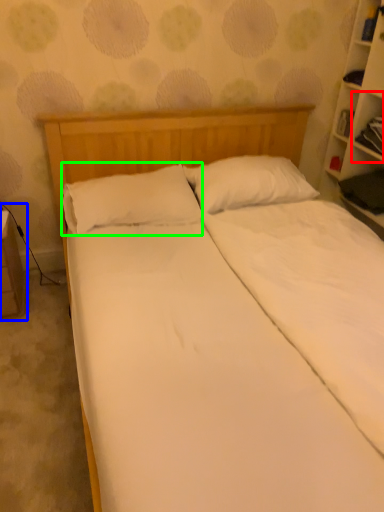
Question: Based on their relative distances, which object is nearer to cabinet (highlighted by a red box)? Choose from table (highlighted by a blue box) and pillow (highlighted by a green box).

Choices:
 (A) table
 (B) pillow

Answer: (B)